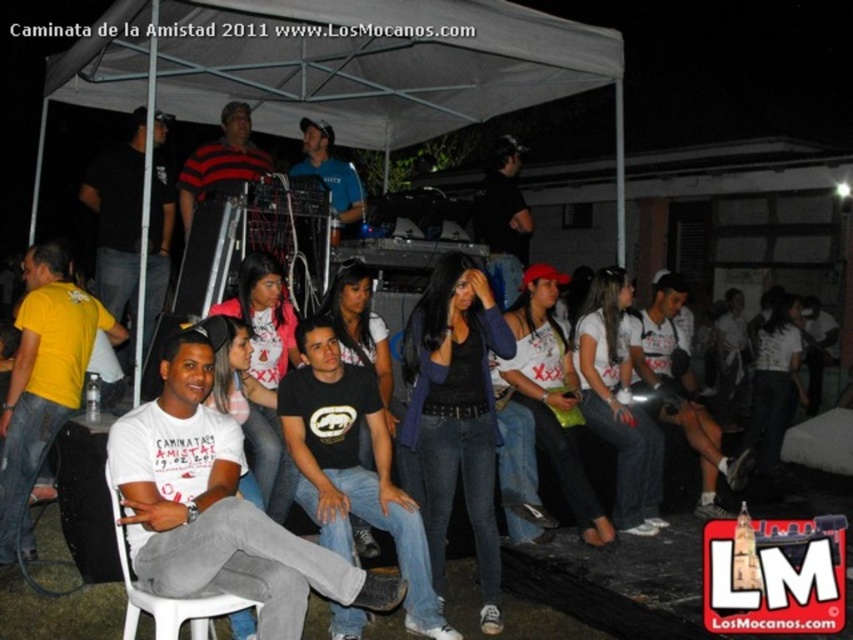
From the picture: What is located at the coordinates point (44, 381)?

The location at point (44, 381) is occupied by a matte yellow t shirt at lower left.